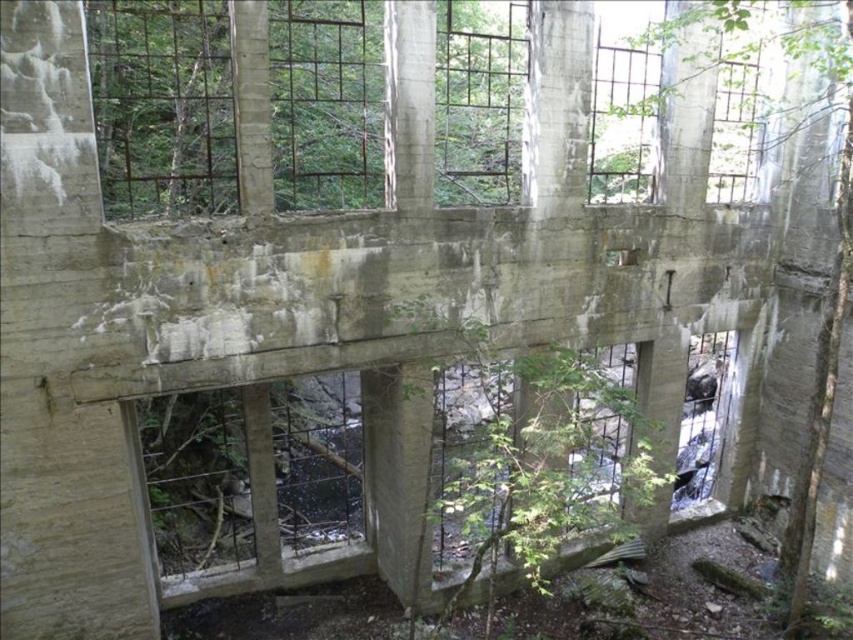
Does point (361, 561) lie in front of point (846, 289)?

No, (361, 561) is behind (846, 289).

Image resolution: width=853 pixels, height=640 pixels. I want to click on rusty metal window at center, so click(254, 484).